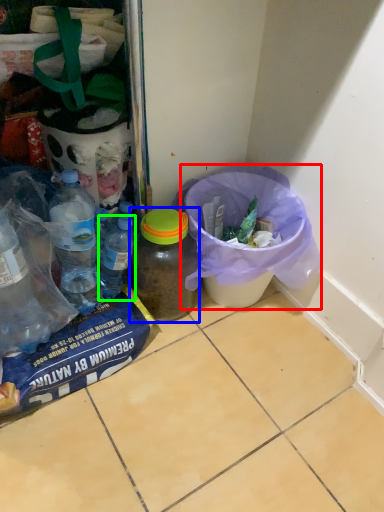
Question: Based on their relative distances, which object is nearer to recycling bin (highlighted by a red box)? Choose from bottle (highlighted by a blue box) and bottle (highlighted by a green box).

Choices:
 (A) bottle
 (B) bottle

Answer: (A)